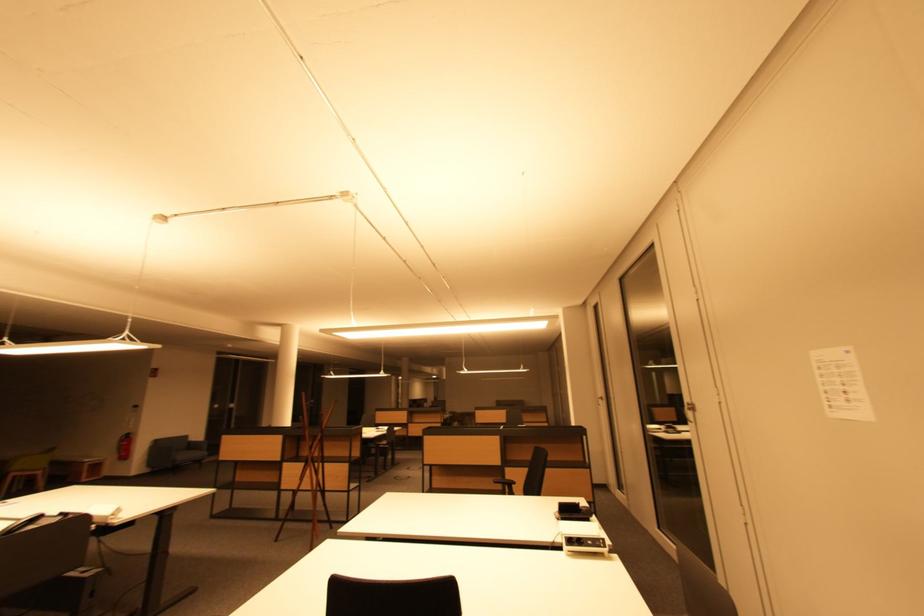
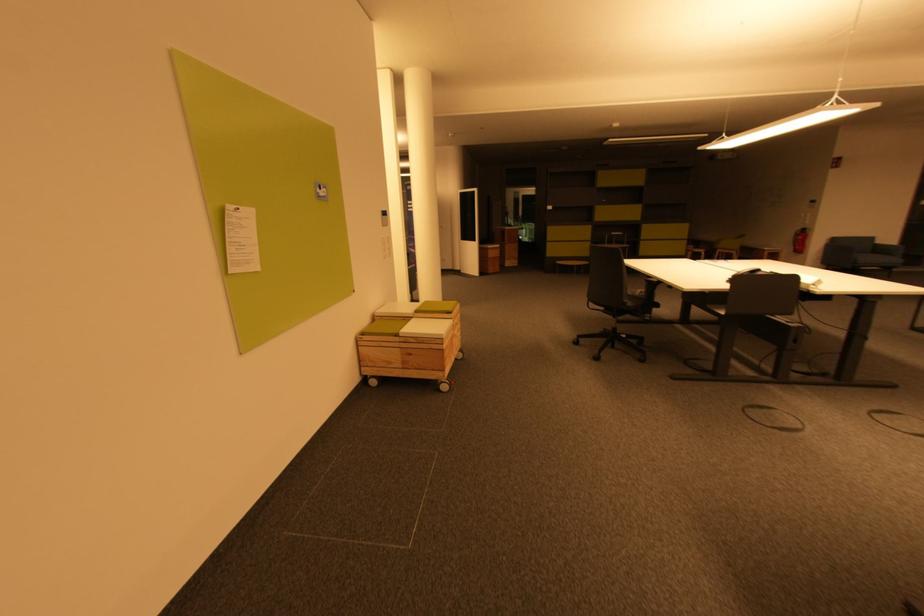
The images are taken continuously from a first-person perspective. In which direction is your viewpoint rotating?

The camera's rotation is toward left-down.